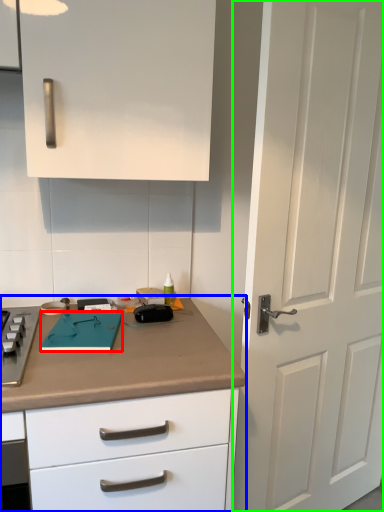
Question: Which object is positioned farthest from notepad (highlighted by a red box)? Select from countertop (highlighted by a blue box) and door (highlighted by a green box).

Choices:
 (A) countertop
 (B) door

Answer: (B)